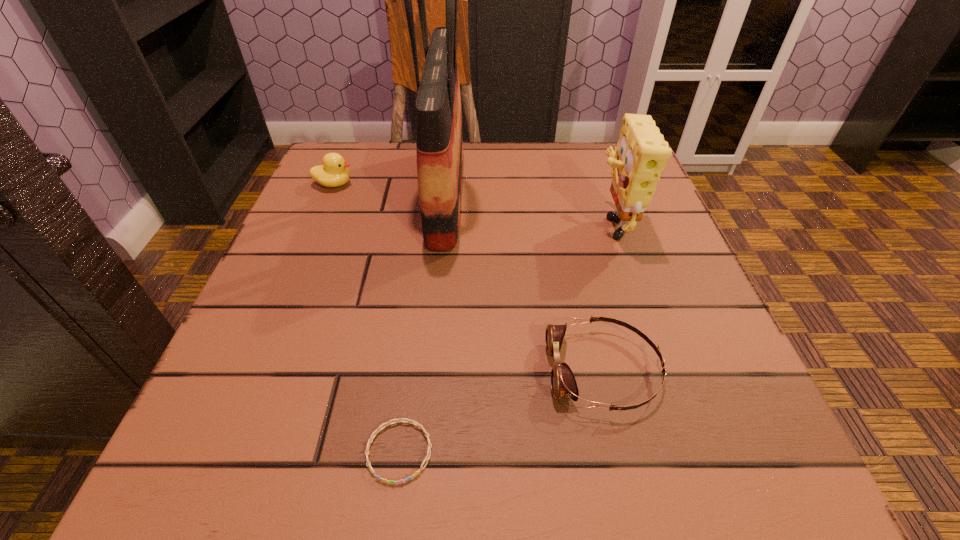
Locate an element on the screen. The width and height of the screenshot is (960, 540). object situated at the left edge is located at coordinates (333, 173).

Where is `sponge present at the right edge`? sponge present at the right edge is located at coordinates (641, 154).

Identify the location of goggles present at the right edge. (563, 383).

Locate an element on the screen. The height and width of the screenshot is (540, 960). object that is at the far left corner is located at coordinates (333, 173).

Image resolution: width=960 pixels, height=540 pixels. Identify the location of object at the far right corner. (641, 154).

In the image, there is a desktop. Identify the location of free region at the far edge. (468, 148).

Where is `free region at the near edge of the desktop`? Image resolution: width=960 pixels, height=540 pixels. free region at the near edge of the desktop is located at coordinates (471, 481).

You are a GUI agent. You are given a task and a screenshot of the screen. Output one action in this format:
    pyautogui.click(x=<x>, y=<y>)
    Task: Click on the vacant region at the left edge of the desktop
    
    Given the screenshot: What is the action you would take?
    pyautogui.click(x=338, y=247)

At what (x,y) coordinates should I click in order to perform the action: click on free point at the right edge. Please return your answer as a coordinate pair (x, y). Looking at the image, I should click on (x=633, y=314).

In the image, there is a desktop. Identify the location of vacant region at the far left corner. The height and width of the screenshot is (540, 960). (385, 146).